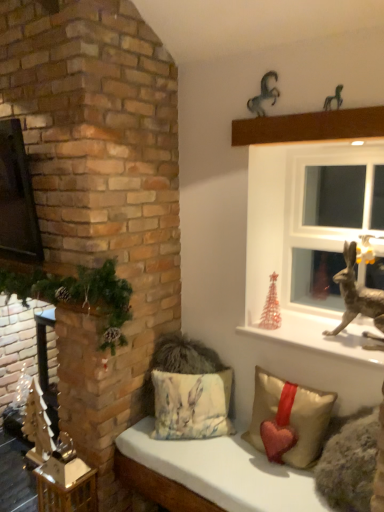
This screenshot has width=384, height=512. Identify the location of vacant space in front of beige fabric pillow with heart at lower center, the 1th pillow in the right-to-left sequence. (268, 490).